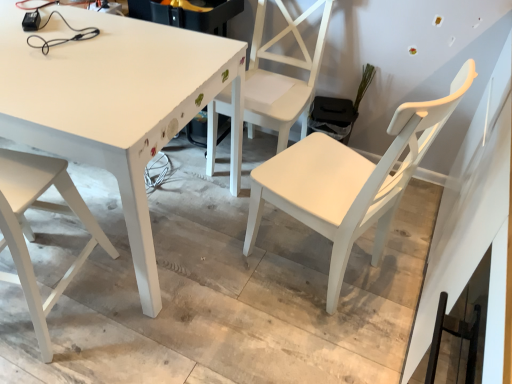
You are a GUI agent. You are given a task and a screenshot of the screen. Output one action in this format:
    pyautogui.click(x=<x>, y=<y>)
    Task: Click on the vacant area situated below white matte chair at center, which appears as the 1th chair when viewed from the right (from a real-world perspective)
    The height and width of the screenshot is (384, 512).
    Given the screenshot: What is the action you would take?
    pyautogui.click(x=312, y=259)